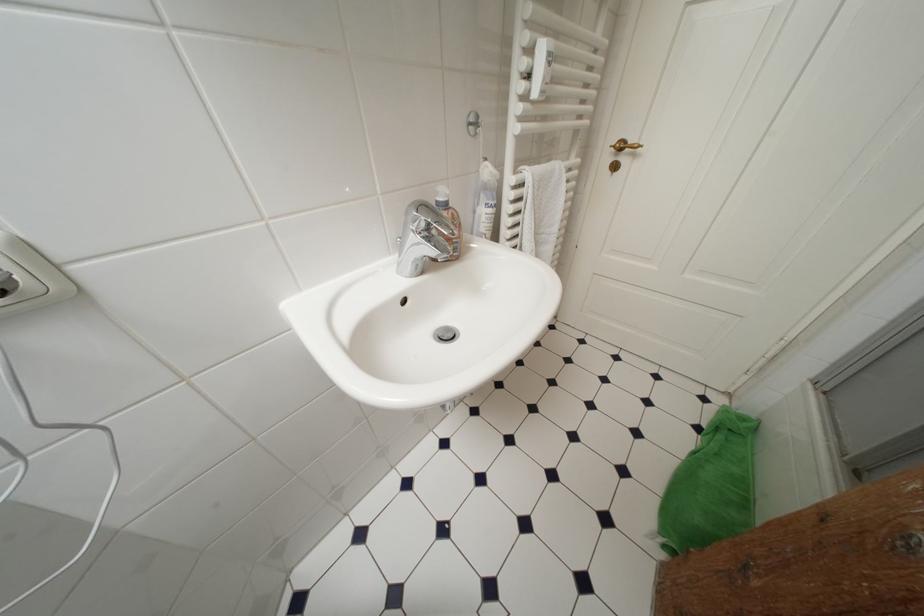
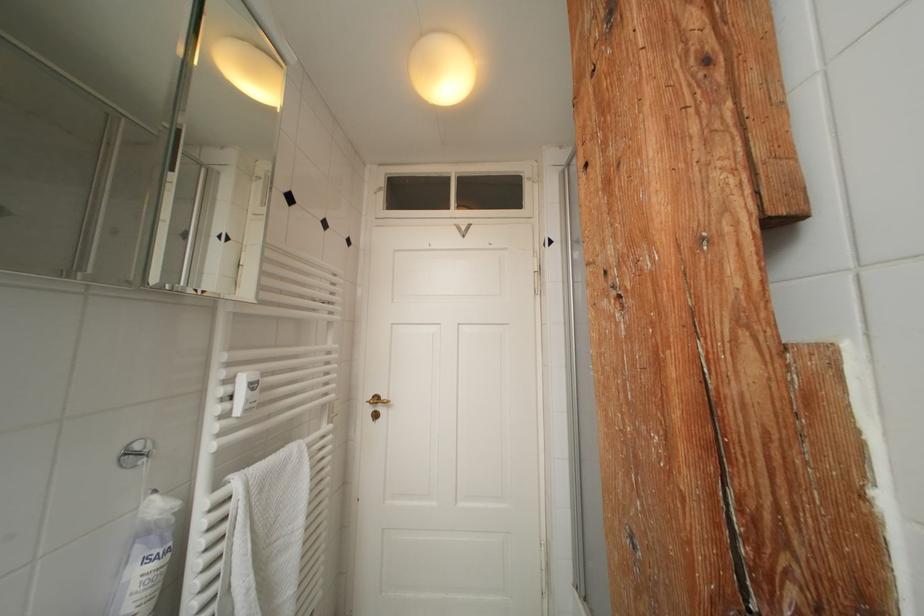
The images are taken continuously from a first-person perspective. In which direction is your viewpoint rotating?

The camera rotated toward right-up.